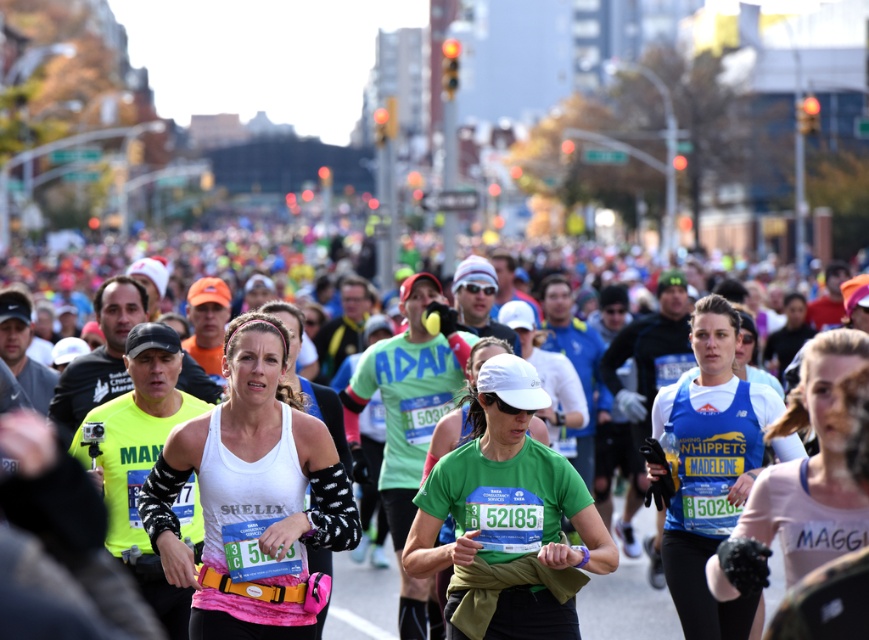
Question: Can you confirm if white matte tank top at center is positioned to the left of green fabric shirt at center?

Choices:
 (A) yes
 (B) no

Answer: (A)

Question: Which is farther from the pink fabric at center?

Choices:
 (A) green fabric shirt at center
 (B) blue fabric shirt at center
 (C) white fabric runners at center
 (D) white matte tank top at center

Answer: (C)

Question: Is white matte tank top at center bigger than pink fabric at center?

Choices:
 (A) no
 (B) yes

Answer: (B)

Question: Which is farther from the green fabric shirt at center?

Choices:
 (A) blue fabric shirt at center
 (B) pink fabric at center
 (C) white fabric runners at center

Answer: (C)

Question: Which point is closer to the camera?

Choices:
 (A) (251, 352)
 (B) (728, 397)

Answer: (A)

Question: Is blue fabric shirt at center wider than pink fabric at center?

Choices:
 (A) yes
 (B) no

Answer: (A)